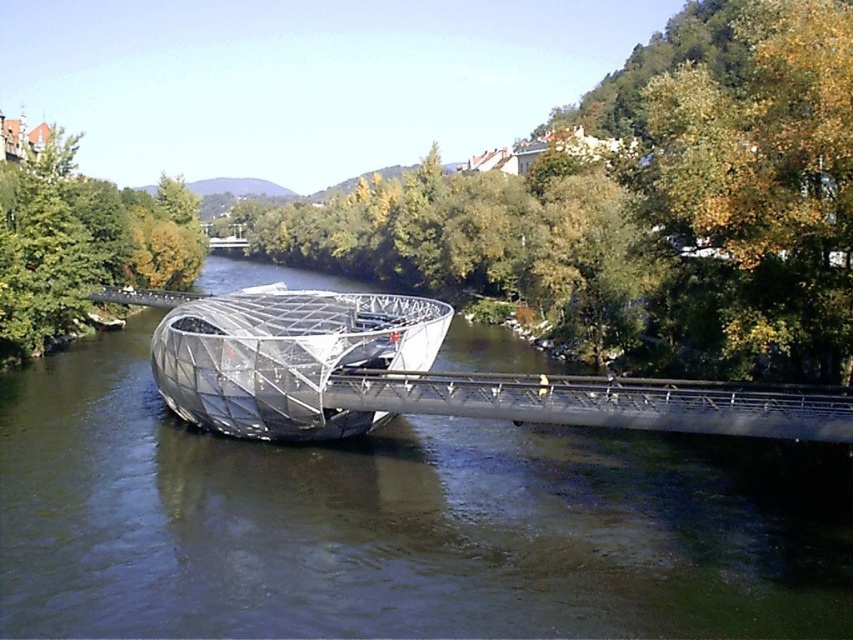
Can you confirm if clear water at bridge center is positioned below transparent glass boat at center?

Yes.

Which is behind, point (515, 452) or point (368, 323)?

Point (368, 323)

Locate an element on the screen. clear water at bridge center is located at coordinates (392, 524).